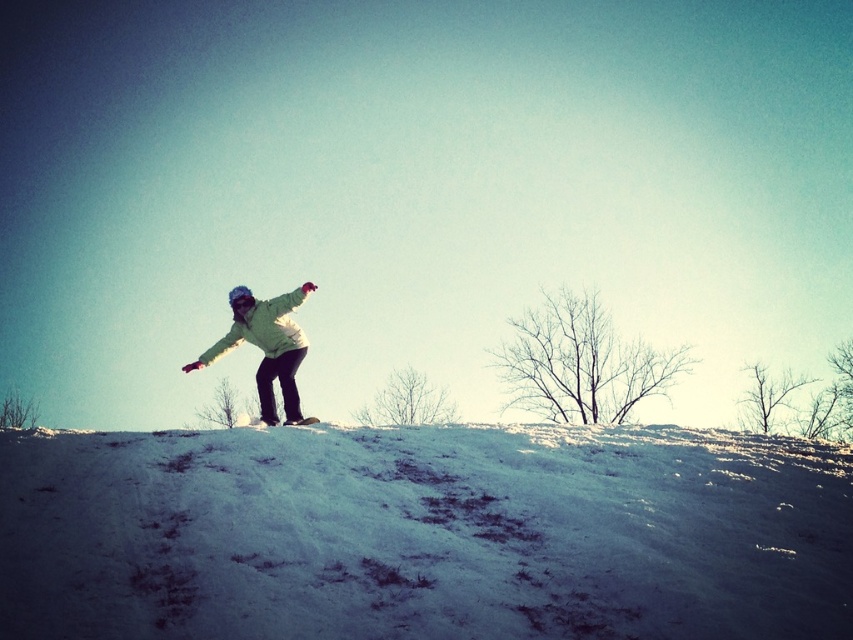
You are planning to build a snowman using the white powdery snow at center and the light green fabric snowboarder at center. Which object would be more suitable for the base of the snowman?

The white powdery snow at center is bigger than the light green fabric snowboarder at center, so it would be more suitable for the base of the snowman since a larger amount of snow is needed for the base.

You are planning to build a snowman using the white powdery snow at center and the light green fabric snowboarder at center. Which material would be more suitable for the base of the snowman?

The white powdery snow at center is more suitable for the base of the snowman because its width is larger than the light green fabric snowboarder at center, providing a stable foundation.

You are a photographer trying to capture the snowboarder. Since the light green fabric snowboarder at center and the white matte snowboard at center are both in the frame, which object is covering the other?

The light green fabric snowboarder at center is positioned over the white matte snowboard at center, so it is covering the white matte snowboard at center.